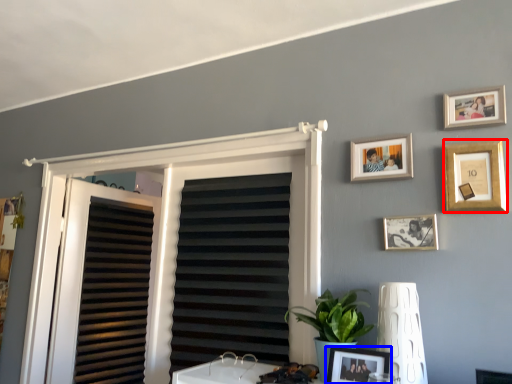
Question: Which of the following is the farthest to the observer, picture frame (highlighted by a red box) or picture frame (highlighted by a blue box)?

Choices:
 (A) picture frame
 (B) picture frame

Answer: (A)